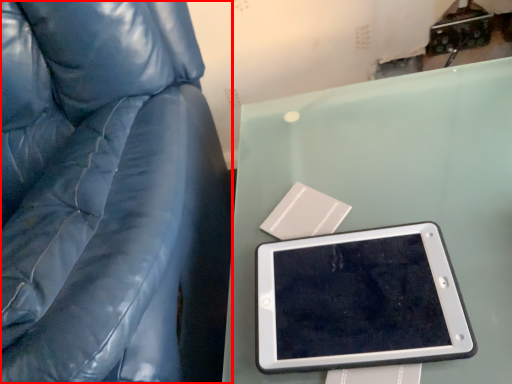
Question: From the image's perspective, what is the correct spatial relationship of furniture (annotated by the red box) in relation to tablet computer?

Choices:
 (A) below
 (B) above

Answer: (B)